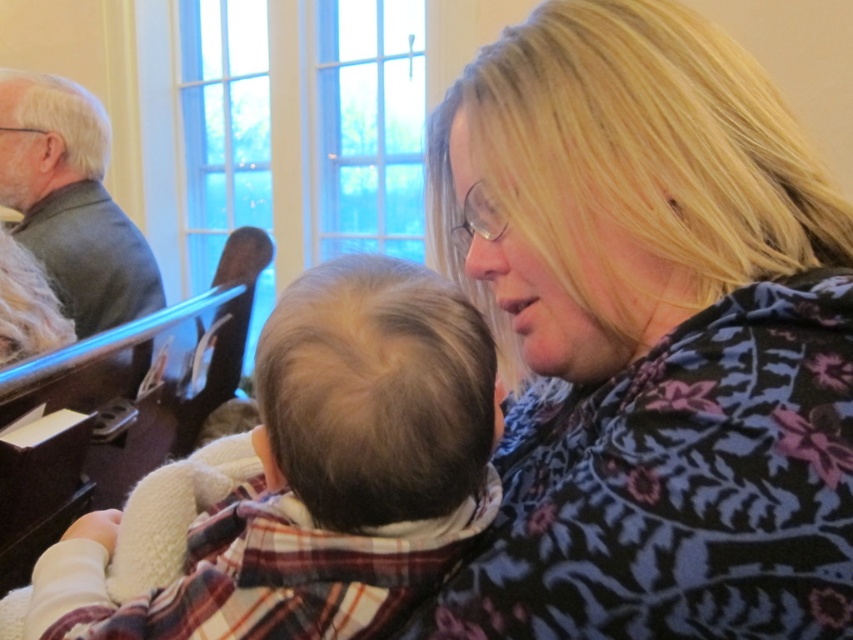
Question: Which point appears closest to the camera in this image?

Choices:
 (A) coord(672,401)
 (B) coord(280,541)

Answer: (A)

Question: Can you confirm if floral-patterned sweater at center is positioned to the left of fluffy white baby at center?

Choices:
 (A) no
 (B) yes

Answer: (A)

Question: Is floral-patterned sweater at center behind fluffy white baby at center?

Choices:
 (A) no
 (B) yes

Answer: (A)

Question: Is the position of floral-patterned sweater at center more distant than that of fluffy white baby at center?

Choices:
 (A) no
 (B) yes

Answer: (A)

Question: Which point is closer to the camera?

Choices:
 (A) (477, 241)
 (B) (412, 337)

Answer: (B)